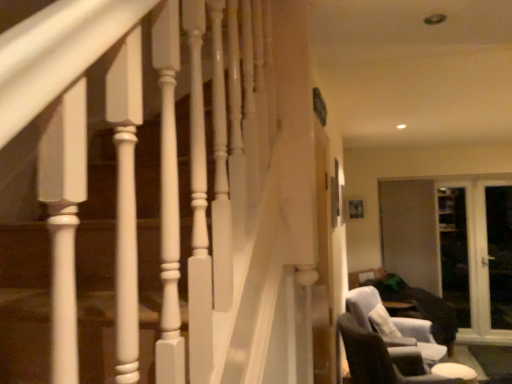
Question: From the image's perspective, is white glossy door at right, positioned as the 4th screen door in left-to-right order, located above or below transparent glass screen door at right, the 2th screen door in the right-to-left sequence?

Choices:
 (A) below
 (B) above

Answer: (B)

Question: Would you say white glossy door at right, positioned as the 4th screen door in left-to-right order, is inside or outside transparent glass screen door at right, the 3th screen door viewed from the left?

Choices:
 (A) inside
 (B) outside

Answer: (B)

Question: Based on their relative distances, which object is farther from the transparent glass screen door at right, placed as the fourth screen door when sorted from right to left?

Choices:
 (A) dark gray fabric swivel chair at lower right
 (B) transparent glass screen door at right, the 3th screen door viewed from the left
 (C) white glossy door at right, placed as the first screen door when sorted from right to left
 (D) dark gray fabric chair at lower right
 (E) transparent glass screen door at right, which appears as the third screen door when viewed from the right

Answer: (D)

Question: Which of these objects is positioned closest to the white glossy door at right, positioned as the 4th screen door in left-to-right order?

Choices:
 (A) dark gray fabric chair at lower right
 (B) transparent glass screen door at right, placed as the fourth screen door when sorted from right to left
 (C) dark gray fabric swivel chair at lower right
 (D) transparent glass screen door at right, which appears as the third screen door when viewed from the right
 (E) transparent glass screen door at right, the 2th screen door in the right-to-left sequence

Answer: (D)